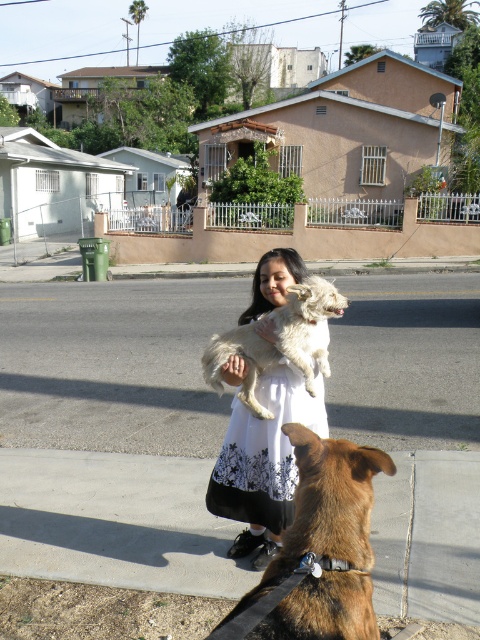
Question: Can you confirm if brown furry dog at lower center is positioned to the right of white lace dress at center?

Choices:
 (A) no
 (B) yes

Answer: (B)

Question: Among these points, which one is nearest to the camera?

Choices:
 (A) (321, 291)
 (B) (240, 630)
 (C) (267, 333)

Answer: (B)

Question: Does brown furry dog at lower center have a lesser width compared to white lace dress at center?

Choices:
 (A) yes
 (B) no

Answer: (A)

Question: Does white lace dress at center appear under white fluffy dog at center?

Choices:
 (A) yes
 (B) no

Answer: (A)

Question: Which point is closer to the camera?

Choices:
 (A) click(x=355, y=509)
 (B) click(x=266, y=401)

Answer: (A)

Question: Which of the following is the closest to the observer?

Choices:
 (A) brown furry dog at lower center
 (B) white lace dress at center
 (C) white fluffy dog at center

Answer: (A)